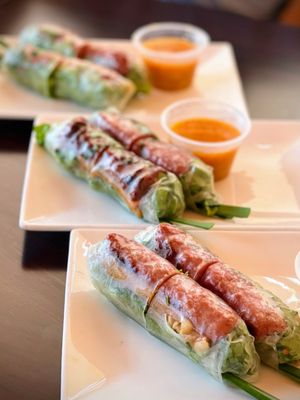
Find the location of `plastic cup`. plastic cup is located at coordinates (235, 112), (197, 39).